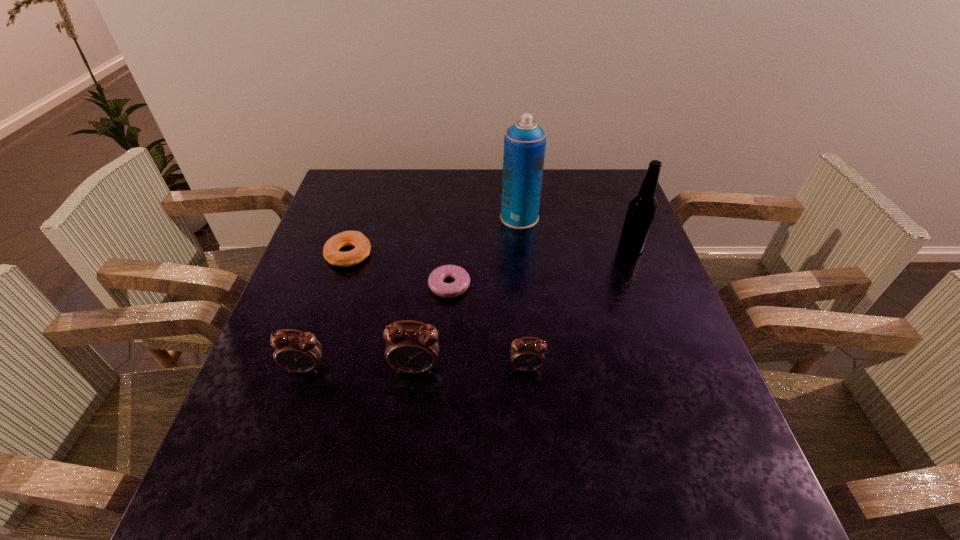
This screenshot has height=540, width=960. What are the coordinates of `free space between the rightmost object and the shortest alarm clock` in the screenshot? It's located at (578, 308).

At what (x,y) coordinates should I click in order to perform the action: click on free space between the second tallest alarm clock and the shortest object. Please return your answer as a coordinate pair (x, y). This screenshot has width=960, height=540. Looking at the image, I should click on (377, 327).

You are a GUI agent. You are given a task and a screenshot of the screen. Output one action in this format:
    pyautogui.click(x=<x>, y=<y>)
    Task: Click on the free point between the second alarm clock from left to right and the second shortest alarm clock
    The height and width of the screenshot is (540, 960).
    Given the screenshot: What is the action you would take?
    pyautogui.click(x=361, y=368)

Identify the location of free space that is in between the sixth tallest object and the sixth shortest object. This screenshot has height=540, width=960. (490, 251).

Identify the location of free spot between the second tallest object and the second shortest alarm clock. (468, 308).

This screenshot has width=960, height=540. Find the location of `vacant area that lies between the third tallest object and the fourth shortest object`. vacant area that lies between the third tallest object and the fourth shortest object is located at coordinates (361, 368).

The height and width of the screenshot is (540, 960). What are the coordinates of `free space between the shortest object and the third shortest object` in the screenshot? It's located at (488, 326).

Locate an element on the screen. Image resolution: width=960 pixels, height=540 pixels. free space between the fourth nearest object and the leftmost alarm clock is located at coordinates (377, 327).

Select which object appears as the second closest to the third tallest object. Please provide its 2D coordinates. Your answer should be formatted as a tuple, i.e. [(x, y)], where the tuple contains the x and y coordinates of a point satisfying the conditions above.

[(525, 355)]

You are a GUI agent. You are given a task and a screenshot of the screen. Output one action in this format:
    pyautogui.click(x=<x>, y=<y>)
    Task: Click on the object that ranks as the fourth closest to the rightmost object
    This screenshot has width=960, height=540.
    Given the screenshot: What is the action you would take?
    pyautogui.click(x=412, y=349)